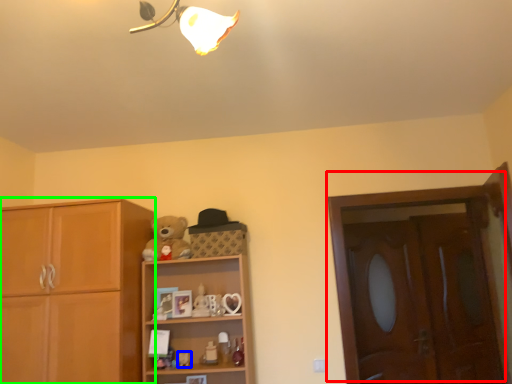
Question: Estimate the real-world distances between objects in this image. Which object is closer to door (highlighted by a red box), toy (highlighted by a blue box) or cabinetry (highlighted by a green box)?

Choices:
 (A) toy
 (B) cabinetry

Answer: (A)